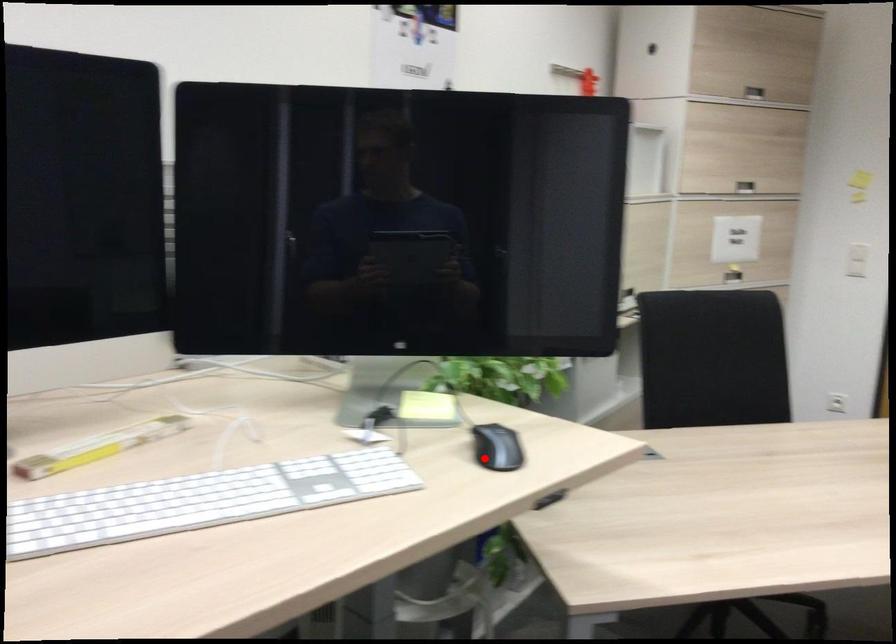
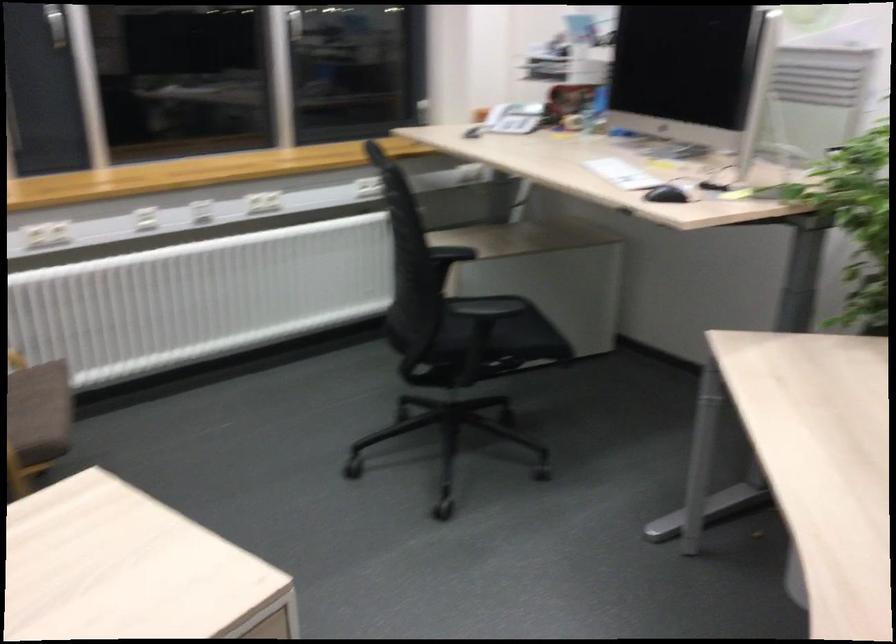
Question: I am providing you with two images of the same scene from different viewpoints. A red point is shown in image1. For the corresponding object point in image2, is it positioned nearer or farther from the camera?

Choices:
 (A) Nearer
 (B) Farther

Answer: (B)